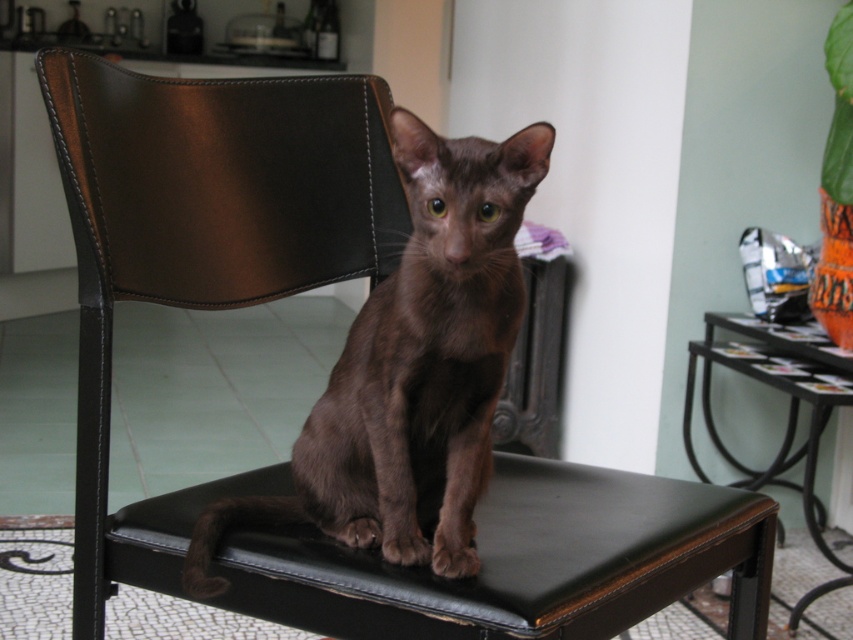
Question: Which object is farther from the camera taking this photo?

Choices:
 (A) black leather stool at center
 (B) brown matte cat at center

Answer: (B)

Question: Does black leather stool at center have a greater width compared to brown matte cat at center?

Choices:
 (A) yes
 (B) no

Answer: (A)

Question: Which of the following is the farthest from the observer?

Choices:
 (A) black leather stool at center
 (B) brown matte cat at center

Answer: (B)

Question: Can you confirm if black leather stool at center is smaller than brown matte cat at center?

Choices:
 (A) yes
 (B) no

Answer: (B)

Question: Which point is closer to the camera?

Choices:
 (A) brown matte cat at center
 (B) black leather stool at center

Answer: (B)

Question: Is black leather stool at center smaller than brown matte cat at center?

Choices:
 (A) no
 (B) yes

Answer: (A)